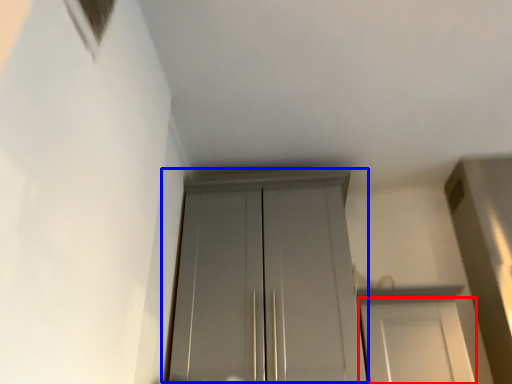
Question: Which object is further to the camera taking this photo, door (highlighted by a red box) or door (highlighted by a blue box)?

Choices:
 (A) door
 (B) door

Answer: (B)